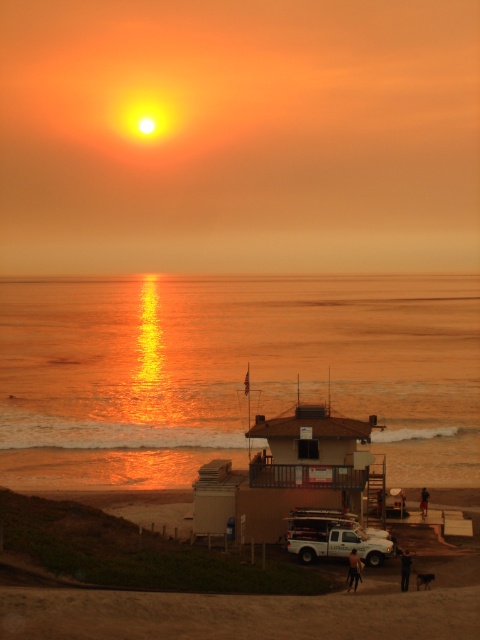
The image size is (480, 640). What do you see at coordinates (354, 570) in the screenshot? I see `black leather pants at lower center` at bounding box center [354, 570].

Find the location of a particular element. This screenshot has width=480, height=640. black leather pants at lower center is located at coordinates (354, 570).

Between black leather pants at lower center and brown leather pants at lower center, which one is positioned lower?

Positioned lower is brown leather pants at lower center.

Does black leather pants at lower center appear under brown leather pants at lower center?

Actually, black leather pants at lower center is above brown leather pants at lower center.

Locate an element on the screen. black leather pants at lower center is located at coordinates (354, 570).

Does golden reflective water at center appear over black leather pants at lower center?

Correct, golden reflective water at center is located above black leather pants at lower center.

Which is below, golden reflective water at center or black leather pants at lower center?

Positioned lower is black leather pants at lower center.

Is point (117, 440) less distant than point (348, 589)?

No, (117, 440) is further to viewer.

The width and height of the screenshot is (480, 640). Find the location of `golden reflective water at center`. golden reflective water at center is located at coordinates (230, 371).